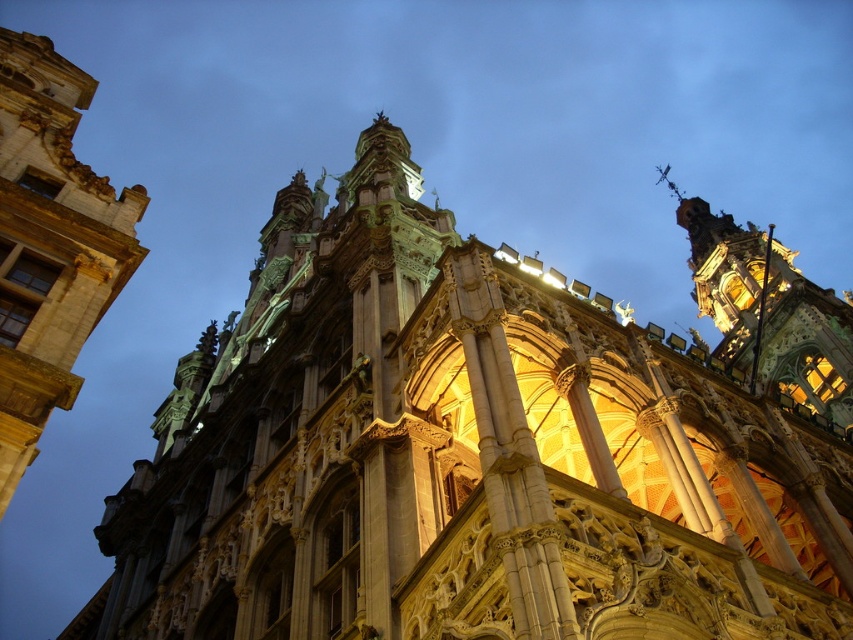
Can you confirm if golden stone tower at upper left is wider than gold ornate tower at upper right?

No, golden stone tower at upper left is not wider than gold ornate tower at upper right.

Is golden stone tower at upper left behind gold ornate tower at upper right?

No, golden stone tower at upper left is in front of gold ornate tower at upper right.

Is point (105, 212) positioned in front of point (753, 278)?

Yes, point (105, 212) is in front of point (753, 278).

Identify the location of golden stone tower at upper left. (50, 243).